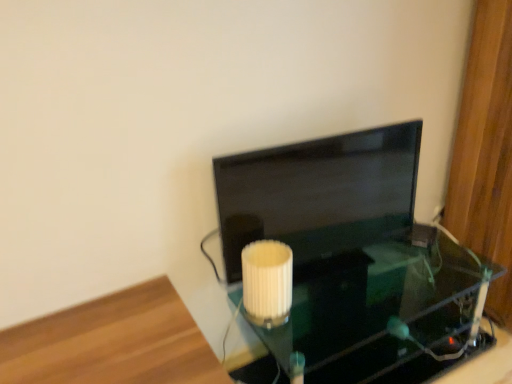
Question: From the image's perspective, is transparent glass table at center positioned above or below white ribbed lampshade at center?

Choices:
 (A) below
 (B) above

Answer: (A)

Question: Is transparent glass table at center wider or thinner than white ribbed lampshade at center?

Choices:
 (A) thin
 (B) wide

Answer: (B)

Question: Which object is positioned farthest from the white ribbed lampshade at center?

Choices:
 (A) wooden floor at lower left
 (B) matte black monitor at center
 (C) transparent glass table at center

Answer: (C)

Question: Which of these objects is positioned farthest from the matte black monitor at center?

Choices:
 (A) white ribbed lampshade at center
 (B) transparent glass table at center
 (C) wooden floor at lower left

Answer: (C)